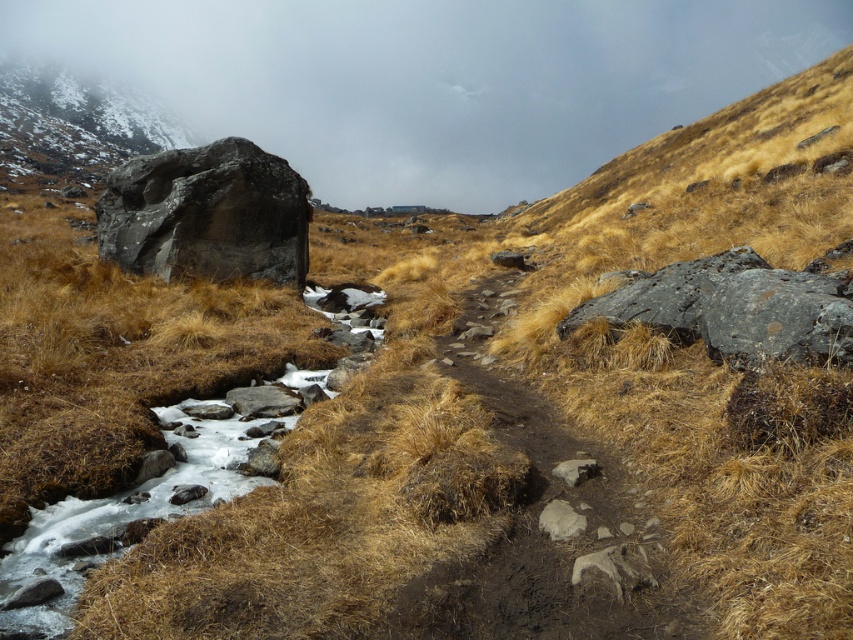
Question: Does foggy mist at upper center appear on the left side of smooth gray rock at lower center?

Choices:
 (A) yes
 (B) no

Answer: (A)

Question: Which point is closer to the camera taking this photo?

Choices:
 (A) (561, 163)
 (B) (32, 115)
 (C) (20, 625)
 (D) (180, 202)

Answer: (C)

Question: Which object is farther from the camera taking this photo?

Choices:
 (A) foggy mist at upper center
 (B) dark gray rough boulder at center-left
 (C) white ice at center
 (D) smooth gray rock at lower center

Answer: (A)

Question: Can you confirm if foggy mist at upper center is wider than dark gray rough boulder at center-left?

Choices:
 (A) yes
 (B) no

Answer: (A)

Question: Which point is closer to the camera taking this photo?

Choices:
 (A) (206, 461)
 (B) (126, 236)
 (C) (540, 524)

Answer: (C)

Question: Is white ice at center below snowy granite boulder at upper left?

Choices:
 (A) yes
 (B) no

Answer: (A)